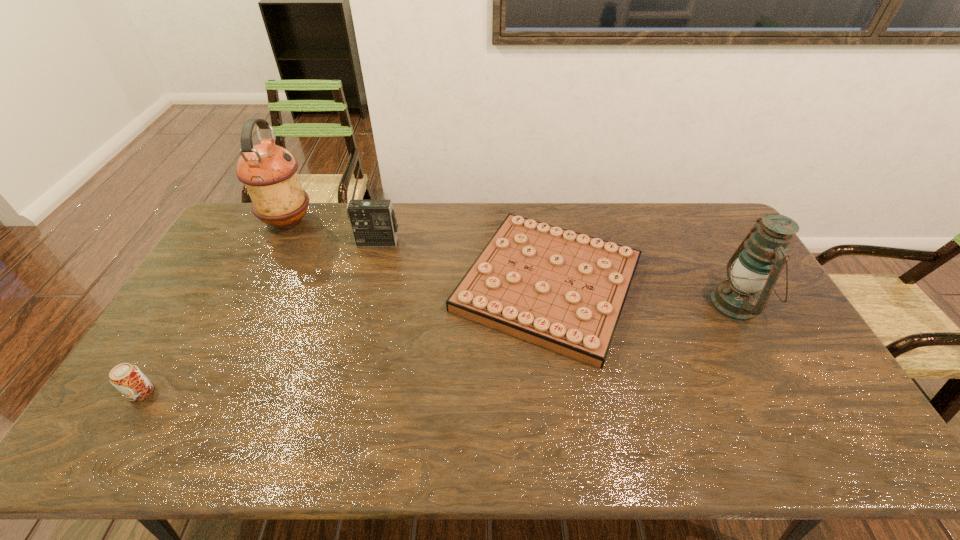
Locate an element on the screen. Image resolution: width=960 pixels, height=540 pixels. free space located 0.090m on the display of the radio receiver is located at coordinates (372, 265).

Where is `free space located 0.270m on the left of the rightmost object`? This screenshot has height=540, width=960. free space located 0.270m on the left of the rightmost object is located at coordinates (623, 304).

Find the location of `vacant area situated 0.260m on the right of the nearest object`. vacant area situated 0.260m on the right of the nearest object is located at coordinates (253, 393).

At what (x,y) coordinates should I click in order to perform the action: click on vacant region located on the right of the second object from right to left. Please return your answer as a coordinate pair (x, y). This screenshot has width=960, height=540. Looking at the image, I should click on (763, 284).

This screenshot has width=960, height=540. Identify the location of oil lamp at the far edge. (269, 172).

You are a GUI agent. You are given a task and a screenshot of the screen. Output one action in this format:
    pyautogui.click(x=<x>, y=<y>)
    Task: Click on the radio receiver at the far edge
    Image resolution: width=960 pixels, height=540 pixels.
    Given the screenshot: What is the action you would take?
    pyautogui.click(x=373, y=222)

This screenshot has height=540, width=960. In order to click on gameboard that is at the far edge in this screenshot , I will do `click(565, 291)`.

Locate an element on the screen. oil lamp at the left edge is located at coordinates (269, 172).

Where is `beer can that is at the left edge`? Image resolution: width=960 pixels, height=540 pixels. beer can that is at the left edge is located at coordinates (127, 378).

I want to click on object that is at the right edge, so click(x=757, y=263).